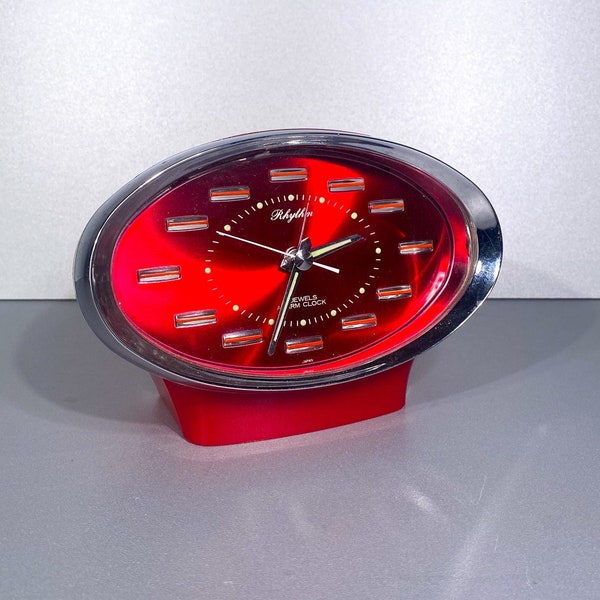
Locate an element on the screen. red and silver clock is located at coordinates (295, 286).